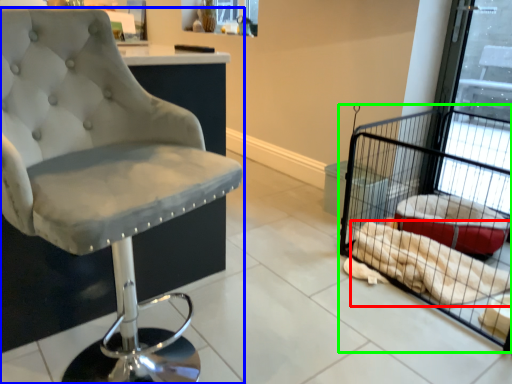
Question: Based on their relative distances, which object is nearer to material (highlighted by a red box)? Choose from chair (highlighted by a blue box) and bird cage (highlighted by a green box).

Choices:
 (A) chair
 (B) bird cage

Answer: (B)